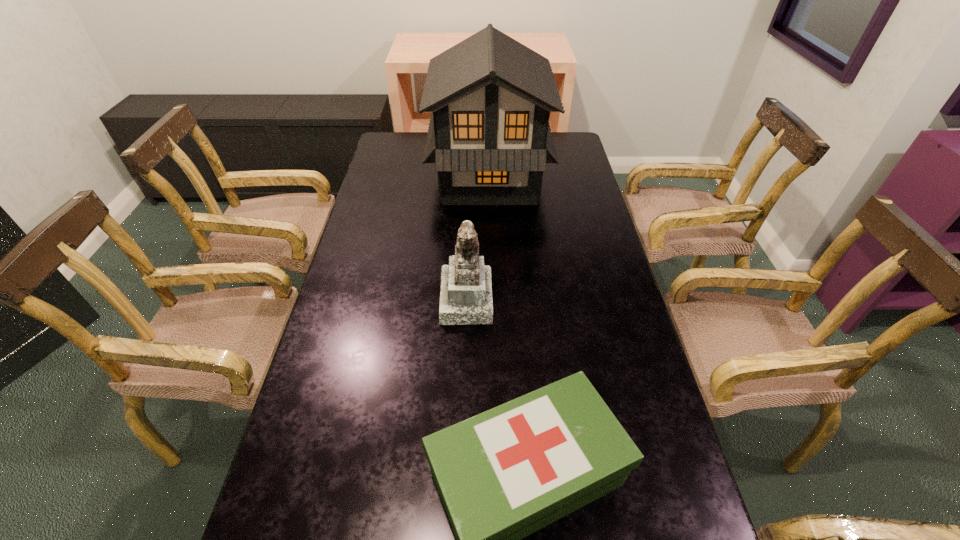
At what (x,y) coordinates should I click in order to perform the action: click on object positioned at the far right corner. Please return your answer as a coordinate pair (x, y). Looking at the image, I should click on (489, 136).

You are a GUI agent. You are given a task and a screenshot of the screen. Output one action in this format:
    pyautogui.click(x=<x>, y=<y>)
    Task: Click on the vacant space at the left edge of the desktop
    The height and width of the screenshot is (540, 960).
    Given the screenshot: What is the action you would take?
    pyautogui.click(x=300, y=515)

This screenshot has height=540, width=960. What are the coordinates of `vacant region at the right edge of the desktop` in the screenshot? It's located at (564, 283).

In the image, there is a desktop. Where is `free region at the far left corner`? The width and height of the screenshot is (960, 540). free region at the far left corner is located at coordinates (399, 139).

The image size is (960, 540). Identify the location of object that is the closest to the second shortest object. click(x=503, y=474).

Choose which object is the nearest neighbor to the first-aid kit. Please provide its 2D coordinates. Your answer should be formatted as a tuple, i.e. [(x, y)], where the tuple contains the x and y coordinates of a point satisfying the conditions above.

[(466, 290)]